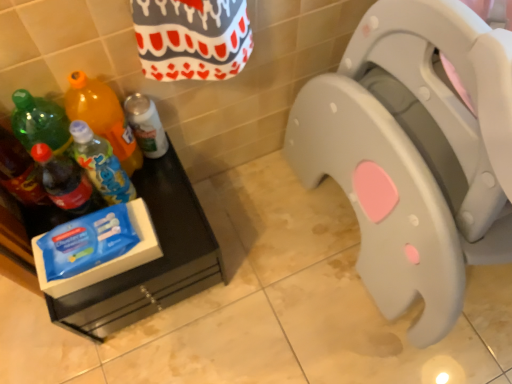
Measure the distance between gray plastic toilet seat at center and camera.

gray plastic toilet seat at center is 20.45 inches from camera.

What do you see at coordinates (19, 172) in the screenshot?
I see `translucent plastic soda bottle at left, which is counted as the first bottle, starting from the left` at bounding box center [19, 172].

Identify the location of blue plastic bottle at left, placed as the second bottle when sorted from right to left. The width and height of the screenshot is (512, 384). (101, 164).

Locate an element on the screen. Image resolution: width=512 pixels, height=384 pixels. the 3rd bottle in front of the blue plastic bottle at left, arranged as the fourth bottle when viewed from the left is located at coordinates (19, 172).

Is blue plastic bottle at left, placed as the second bottle when sorted from right to left, smaller than translucent plastic soda bottle at left, which is counted as the first bottle, starting from the left?

Indeed, blue plastic bottle at left, placed as the second bottle when sorted from right to left, has a smaller size compared to translucent plastic soda bottle at left, which is counted as the first bottle, starting from the left.

Could you tell me if blue plastic bottle at left, arranged as the fourth bottle when viewed from the left, is turned towards translucent plastic soda bottle at left, which is counted as the first bottle, starting from the left?

No.

Can you confirm if blue plastic bottle at left, arranged as the fourth bottle when viewed from the left, is taller than translucent plastic soda bottle at left, which is counted as the first bottle, starting from the left?

No.

Considering the relative sizes of translucent plastic bottle at left, which is the third bottle from left to right, and translucent plastic soda bottle at left, which is the second bottle from left to right, in the image provided, is translucent plastic bottle at left, which is the third bottle from left to right, smaller than translucent plastic soda bottle at left, which is the second bottle from left to right,?

Incorrect, translucent plastic bottle at left, which is the third bottle from left to right, is not smaller in size than translucent plastic soda bottle at left, which is the second bottle from left to right.

You are a GUI agent. You are given a task and a screenshot of the screen. Output one action in this format:
    pyautogui.click(x=<x>, y=<y>)
    Task: Click on the 1st bottle behind the translucent plastic soda bottle at left, the fourth bottle when ordered from right to left, counting from the anchor's position
    
    Given the screenshot: What is the action you would take?
    pyautogui.click(x=103, y=117)

In the scene shown: Is translucent plastic bottle at left, which appears as the 3th bottle when viewed from the right, not inside translucent plastic soda bottle at left, which is the second bottle from left to right?

Indeed, translucent plastic bottle at left, which appears as the 3th bottle when viewed from the right, is completely outside translucent plastic soda bottle at left, which is the second bottle from left to right.

Is translucent plastic bottle at left, which appears as the 3th bottle when viewed from the right, oriented away from translucent plastic soda bottle at left, which is the second bottle from left to right?

No.

Identify the location of bottle lying on the left of translucent plastic soda bottle at left, which is the second bottle from left to right. Image resolution: width=512 pixels, height=384 pixels. (19, 172).

From a real-world perspective, who is located higher, translucent plastic soda bottle at left, which is the second bottle from left to right, or translucent plastic soda bottle at left, which is counted as the first bottle, starting from the left?

translucent plastic soda bottle at left, which is counted as the first bottle, starting from the left.

Does translucent plastic soda bottle at left, which is the second bottle from left to right, contain translucent plastic soda bottle at left, which is counted as the first bottle, starting from the left?

No, translucent plastic soda bottle at left, which is counted as the first bottle, starting from the left, is located outside of translucent plastic soda bottle at left, which is the second bottle from left to right.

Which of these two, translucent plastic soda bottle at left, which is the second bottle from left to right, or translucent plastic soda bottle at left, which appears as the 5th bottle when viewed from the right, is smaller?

Smaller between the two is translucent plastic soda bottle at left, which is the second bottle from left to right.

Which object is positioned more to the right, white matte spray can at lower left, which ranks as the 5th bottle in left-to-right order, or gray plastic toilet seat at center?

From the viewer's perspective, gray plastic toilet seat at center appears more on the right side.

From a real-world perspective, who is located lower, white matte spray can at lower left, the first bottle positioned from the right, or gray plastic toilet seat at center?

white matte spray can at lower left, the first bottle positioned from the right, from a real-world perspective.

Measure the distance between white matte spray can at lower left, the first bottle positioned from the right, and gray plastic toilet seat at center.

white matte spray can at lower left, the first bottle positioned from the right, is 53.06 centimeters from gray plastic toilet seat at center.

Identify the location of toilet on the right of white matte spray can at lower left, the first bottle positioned from the right. This screenshot has height=384, width=512. (415, 153).

Consider the image. Considering the relative sizes of gray plastic toilet seat at center and translucent plastic soda bottle at left, which is counted as the first bottle, starting from the left, in the image provided, is gray plastic toilet seat at center shorter than translucent plastic soda bottle at left, which is counted as the first bottle, starting from the left,?

In fact, gray plastic toilet seat at center may be taller than translucent plastic soda bottle at left, which is counted as the first bottle, starting from the left.

Consider the image. Is gray plastic toilet seat at center next to translucent plastic soda bottle at left, which is counted as the first bottle, starting from the left, and touching it?

gray plastic toilet seat at center is not next to translucent plastic soda bottle at left, which is counted as the first bottle, starting from the left, and they're not touching.

How different are the orientations of gray plastic toilet seat at center and translucent plastic soda bottle at left, which is counted as the first bottle, starting from the left, in degrees?

They differ by 0.449 degrees in their facing directions.

How far apart are gray plastic toilet seat at center and translucent plastic soda bottle at left, which is counted as the first bottle, starting from the left?

gray plastic toilet seat at center and translucent plastic soda bottle at left, which is counted as the first bottle, starting from the left, are 28.74 inches apart.

Measure the distance between translucent plastic soda bottle at left, which appears as the 5th bottle when viewed from the right, and gray plastic toilet seat at center.

translucent plastic soda bottle at left, which appears as the 5th bottle when viewed from the right, is 28.74 inches from gray plastic toilet seat at center.

Can gray plastic toilet seat at center be found inside translucent plastic soda bottle at left, which appears as the 5th bottle when viewed from the right?

No, gray plastic toilet seat at center is not surrounded by translucent plastic soda bottle at left, which appears as the 5th bottle when viewed from the right.

From a real-world perspective, is translucent plastic soda bottle at left, which appears as the 5th bottle when viewed from the right, positioned over gray plastic toilet seat at center based on gravity?

Indeed, from a real-world perspective, translucent plastic soda bottle at left, which appears as the 5th bottle when viewed from the right, stands above gray plastic toilet seat at center.

Can you tell me how much translucent plastic soda bottle at left, which is counted as the first bottle, starting from the left, and gray plastic toilet seat at center differ in facing direction?

The facing directions of translucent plastic soda bottle at left, which is counted as the first bottle, starting from the left, and gray plastic toilet seat at center are 0.449 degrees apart.

Which is nearer, (153, 135) or (4, 159)?

Clearly, point (153, 135) is more distant from the camera than point (4, 159).

From a real-world perspective, who is located higher, white matte spray can at lower left, the first bottle positioned from the right, or translucent plastic soda bottle at left, which is counted as the first bottle, starting from the left?

translucent plastic soda bottle at left, which is counted as the first bottle, starting from the left, from a real-world perspective.

Which object is closer to the camera taking this photo, white matte spray can at lower left, the first bottle positioned from the right, or translucent plastic soda bottle at left, which appears as the 5th bottle when viewed from the right?

translucent plastic soda bottle at left, which appears as the 5th bottle when viewed from the right, is in front.

The image size is (512, 384). I want to click on the 3rd bottle counting from the left side of the blue plastic bottle at left, placed as the second bottle when sorted from right to left, so click(x=19, y=172).

From the image's perspective, count 3rd bottles downward from the translucent plastic bottle at left, which appears as the 3th bottle when viewed from the right, and point to it. Please provide its 2D coordinates.

[(66, 182)]

When comparing their distances from blue plastic bottle at left, arranged as the fourth bottle when viewed from the left, does translucent plastic soda bottle at left, which is counted as the first bottle, starting from the left, or translucent plastic soda bottle at left, the fourth bottle when ordered from right to left, seem further?

Among the two, translucent plastic soda bottle at left, which is counted as the first bottle, starting from the left, is located further to blue plastic bottle at left, arranged as the fourth bottle when viewed from the left.

From the image, which object appears to be nearer to translucent plastic bottle at left, which appears as the 3th bottle when viewed from the right, blue plastic bottle at left, arranged as the fourth bottle when viewed from the left, or gray plastic toilet seat at center?

Among the two, blue plastic bottle at left, arranged as the fourth bottle when viewed from the left, is located nearer to translucent plastic bottle at left, which appears as the 3th bottle when viewed from the right.

Which object lies further to the anchor point translucent plastic bottle at left, which is the third bottle from left to right, blue plastic bottle at left, placed as the second bottle when sorted from right to left, or translucent plastic soda bottle at left, which is the second bottle from left to right?

translucent plastic soda bottle at left, which is the second bottle from left to right, is positioned further to the anchor translucent plastic bottle at left, which is the third bottle from left to right.

When comparing their distances from translucent plastic soda bottle at left, which appears as the 5th bottle when viewed from the right, does translucent plastic bottle at left, which is the third bottle from left to right, or blue plastic bottle at left, arranged as the fourth bottle when viewed from the left, seem further?

Based on the image, translucent plastic bottle at left, which is the third bottle from left to right, appears to be further to translucent plastic soda bottle at left, which appears as the 5th bottle when viewed from the right.

Considering their positions, is blue plastic bottle at left, placed as the second bottle when sorted from right to left, positioned closer to white matte spray can at lower left, which ranks as the 5th bottle in left-to-right order, than translucent plastic bottle at left, which is the third bottle from left to right?

Based on the image, translucent plastic bottle at left, which is the third bottle from left to right, appears to be nearer to white matte spray can at lower left, which ranks as the 5th bottle in left-to-right order.

Considering their positions, is gray plastic toilet seat at center positioned closer to translucent plastic bottle at left, which is the third bottle from left to right, than translucent plastic soda bottle at left, which is the second bottle from left to right?

translucent plastic soda bottle at left, which is the second bottle from left to right, is positioned closer to the anchor translucent plastic bottle at left, which is the third bottle from left to right.

From the image, which object appears to be nearer to blue plastic bottle at left, arranged as the fourth bottle when viewed from the left, translucent plastic soda bottle at left, the fourth bottle when ordered from right to left, or white matte spray can at lower left, the first bottle positioned from the right?

Among the two, translucent plastic soda bottle at left, the fourth bottle when ordered from right to left, is located nearer to blue plastic bottle at left, arranged as the fourth bottle when viewed from the left.

Considering their positions, is white matte spray can at lower left, the first bottle positioned from the right, positioned closer to translucent plastic soda bottle at left, which appears as the 5th bottle when viewed from the right, than translucent plastic soda bottle at left, the fourth bottle when ordered from right to left?

translucent plastic soda bottle at left, the fourth bottle when ordered from right to left, is closer to translucent plastic soda bottle at left, which appears as the 5th bottle when viewed from the right.

Where is `bottle between blue plastic bottle at left, placed as the second bottle when sorted from right to left, and gray plastic toilet seat at center, in the horizontal direction`? bottle between blue plastic bottle at left, placed as the second bottle when sorted from right to left, and gray plastic toilet seat at center, in the horizontal direction is located at coordinates (146, 125).

Locate an element on the screen. Image resolution: width=512 pixels, height=384 pixels. bottle between translucent plastic bottle at left, which appears as the 3th bottle when viewed from the right, and white matte spray can at lower left, which ranks as the 5th bottle in left-to-right order, along the z-axis is located at coordinates (101, 164).

The height and width of the screenshot is (384, 512). In order to click on bottle located between translucent plastic soda bottle at left, which is counted as the first bottle, starting from the left, and translucent plastic bottle at left, which appears as the 3th bottle when viewed from the right, in the left-right direction in this screenshot , I will do `click(66, 182)`.